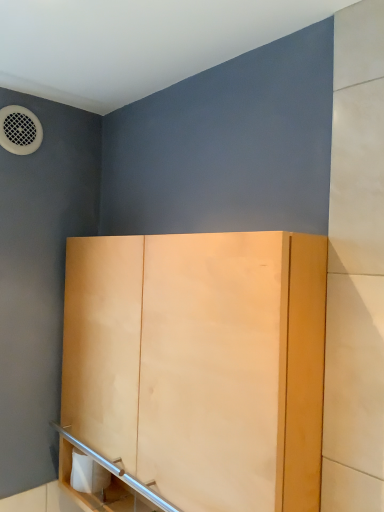
Question: Is light wood cabinet at center next to white matte toilet paper at lower left and touching it?

Choices:
 (A) no
 (B) yes

Answer: (A)

Question: Is light wood cabinet at center positioned behind white matte toilet paper at lower left?

Choices:
 (A) no
 (B) yes

Answer: (A)

Question: Are light wood cabinet at center and white matte toilet paper at lower left far apart?

Choices:
 (A) yes
 (B) no

Answer: (B)

Question: Considering the relative positions of light wood cabinet at center and white matte toilet paper at lower left in the image provided, is light wood cabinet at center to the left of white matte toilet paper at lower left from the viewer's perspective?

Choices:
 (A) no
 (B) yes

Answer: (A)

Question: Does light wood cabinet at center have a lesser height compared to white matte toilet paper at lower left?

Choices:
 (A) yes
 (B) no

Answer: (B)

Question: From a real-world perspective, is light wood cabinet at center on white matte toilet paper at lower left?

Choices:
 (A) yes
 (B) no

Answer: (A)

Question: Does white matte toilet paper at lower left appear on the right side of light wood cabinet at center?

Choices:
 (A) yes
 (B) no

Answer: (B)

Question: Is light wood cabinet at center surrounded by white matte toilet paper at lower left?

Choices:
 (A) yes
 (B) no

Answer: (B)

Question: Are white matte toilet paper at lower left and light wood cabinet at center far apart?

Choices:
 (A) yes
 (B) no

Answer: (B)

Question: Considering the relative sizes of white matte toilet paper at lower left and light wood cabinet at center in the image provided, is white matte toilet paper at lower left shorter than light wood cabinet at center?

Choices:
 (A) yes
 (B) no

Answer: (A)

Question: Is white matte toilet paper at lower left oriented towards light wood cabinet at center?

Choices:
 (A) yes
 (B) no

Answer: (A)

Question: Does white matte toilet paper at lower left lie in front of light wood cabinet at center?

Choices:
 (A) yes
 (B) no

Answer: (B)

Question: Is white matte toilet paper at lower left to the left or to the right of light wood cabinet at center in the image?

Choices:
 (A) left
 (B) right

Answer: (A)